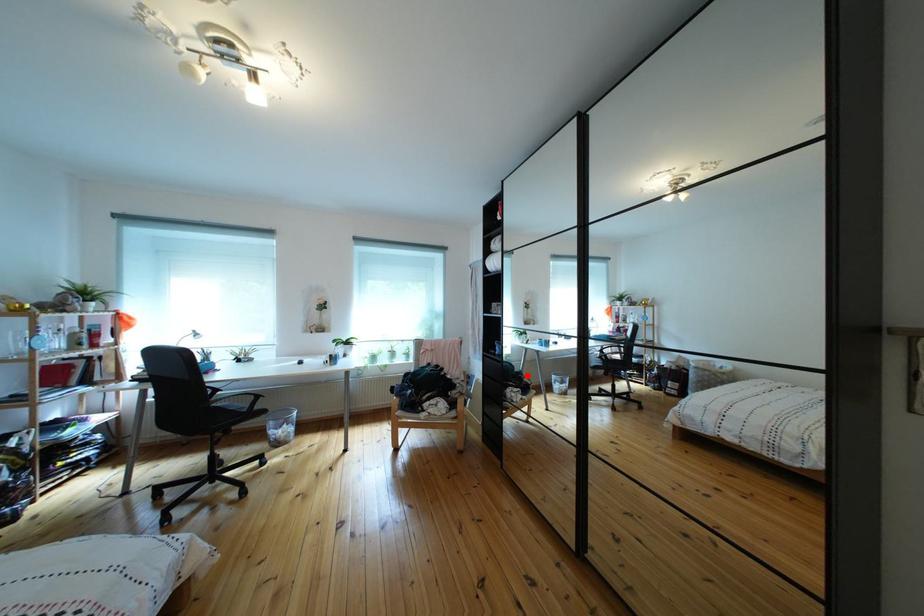
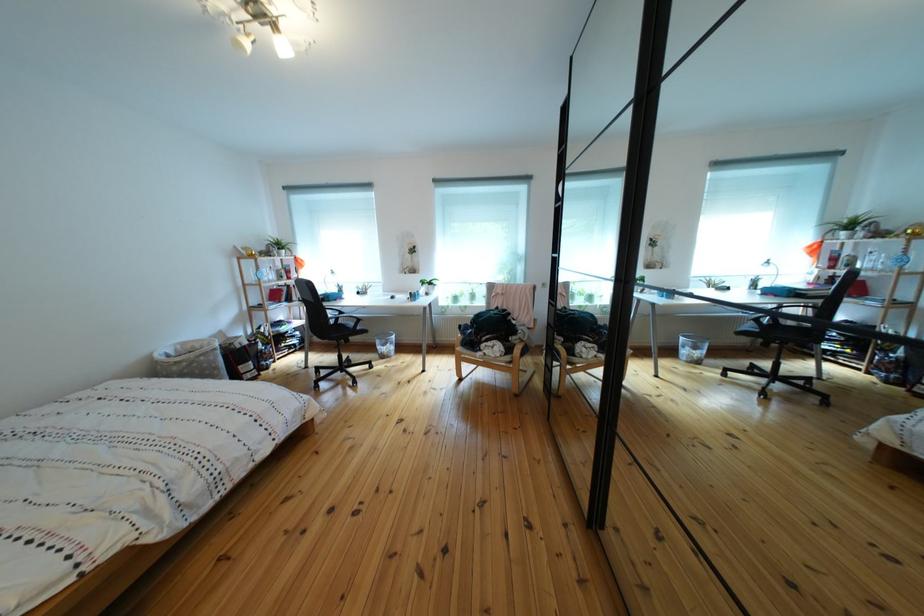
Question: I am providing you with two images of the same scene from different viewpoints. Given a red point in image1, look at the same physical point in image2. Is it:

Choices:
 (A) Closer to the viewpoint
 (B) Farther from the viewpoint

Answer: (B)